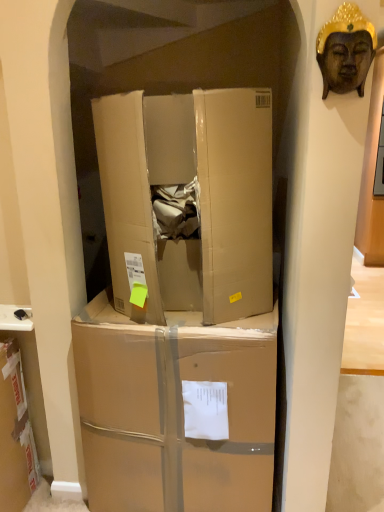
Question: Which direction should I rotate to look at brown cardboard box at center, the 2th box positioned from the top, — up or down?

Choices:
 (A) up
 (B) down

Answer: (B)

Question: Can you confirm if cardboard box at center, the 1th box in the top-to-bottom sequence, is smaller than wooden buddha head at upper right?

Choices:
 (A) yes
 (B) no

Answer: (B)

Question: Does cardboard box at center, which is counted as the second box, starting from the bottom, turn towards wooden buddha head at upper right?

Choices:
 (A) no
 (B) yes

Answer: (A)

Question: Is cardboard box at center, which is counted as the second box, starting from the bottom, turned away from wooden buddha head at upper right?

Choices:
 (A) no
 (B) yes

Answer: (A)

Question: Considering the relative sizes of cardboard box at center, the 1th box in the top-to-bottom sequence, and wooden buddha head at upper right in the image provided, is cardboard box at center, the 1th box in the top-to-bottom sequence, shorter than wooden buddha head at upper right?

Choices:
 (A) yes
 (B) no

Answer: (B)

Question: From the image's perspective, would you say cardboard box at center, the 1th box in the top-to-bottom sequence, is shown under wooden buddha head at upper right?

Choices:
 (A) yes
 (B) no

Answer: (A)

Question: From a real-world perspective, does cardboard box at center, the 1th box in the top-to-bottom sequence, sit lower than wooden buddha head at upper right?

Choices:
 (A) yes
 (B) no

Answer: (A)

Question: Is the depth of brown cardboard box at center, arranged as the first box when ordered from the bottom, greater than that of wooden buddha head at upper right?

Choices:
 (A) yes
 (B) no

Answer: (A)

Question: Considering the relative sizes of brown cardboard box at center, the 2th box positioned from the top, and wooden buddha head at upper right in the image provided, is brown cardboard box at center, the 2th box positioned from the top, wider than wooden buddha head at upper right?

Choices:
 (A) yes
 (B) no

Answer: (A)

Question: Does brown cardboard box at center, arranged as the first box when ordered from the bottom, have a greater height compared to wooden buddha head at upper right?

Choices:
 (A) no
 (B) yes

Answer: (B)

Question: From the image's perspective, does brown cardboard box at center, the 2th box positioned from the top, appear lower than wooden buddha head at upper right?

Choices:
 (A) yes
 (B) no

Answer: (A)

Question: Is brown cardboard box at center, arranged as the first box when ordered from the bottom, far from wooden buddha head at upper right?

Choices:
 (A) no
 (B) yes

Answer: (B)

Question: Is brown cardboard box at center, the 2th box positioned from the top, shorter than wooden buddha head at upper right?

Choices:
 (A) no
 (B) yes

Answer: (A)

Question: Does brown cardboard box at center, arranged as the first box when ordered from the bottom, have a smaller size compared to cardboard box at center, the 1th box in the top-to-bottom sequence?

Choices:
 (A) yes
 (B) no

Answer: (B)